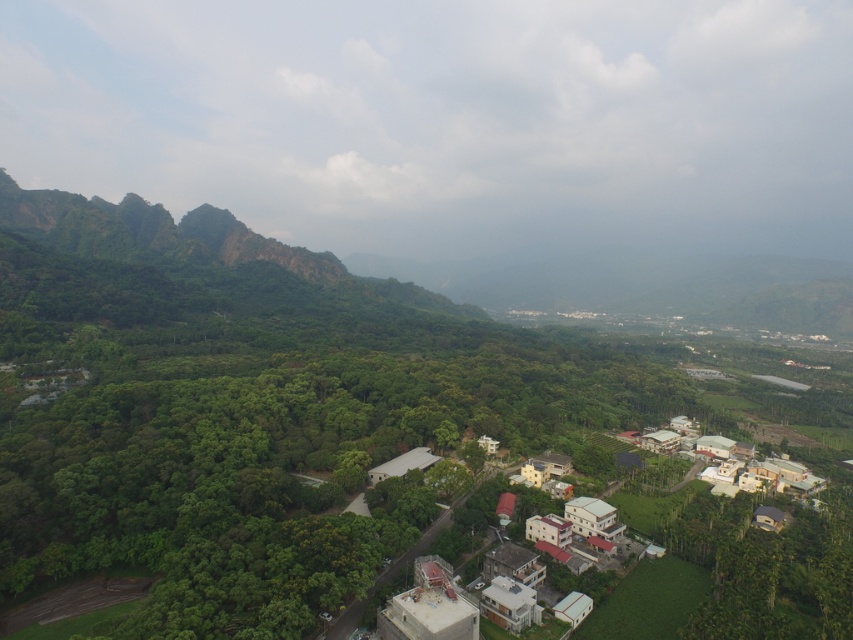
Question: Which point appears farthest from the camera in this image?

Choices:
 (A) (686, 486)
 (B) (190, 449)

Answer: (A)

Question: Does green leafy trees at center have a smaller size compared to white matte houses at lower right?

Choices:
 (A) yes
 (B) no

Answer: (B)

Question: Can you confirm if green leafy trees at center is positioned above white matte houses at lower right?

Choices:
 (A) no
 (B) yes

Answer: (B)

Question: Is green leafy trees at center closer to the viewer compared to white matte houses at lower right?

Choices:
 (A) yes
 (B) no

Answer: (A)